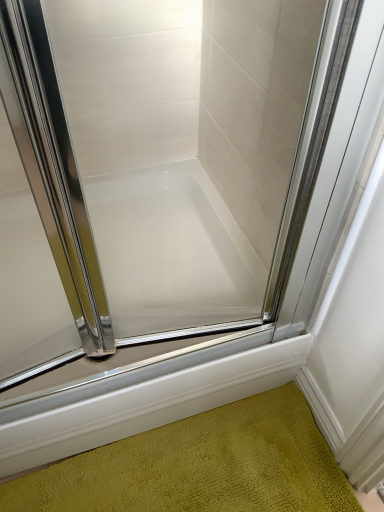
Find the location of a particular element. vacant area on top of green textured bath mat at lower center (from a real-world perspective) is located at coordinates (239, 466).